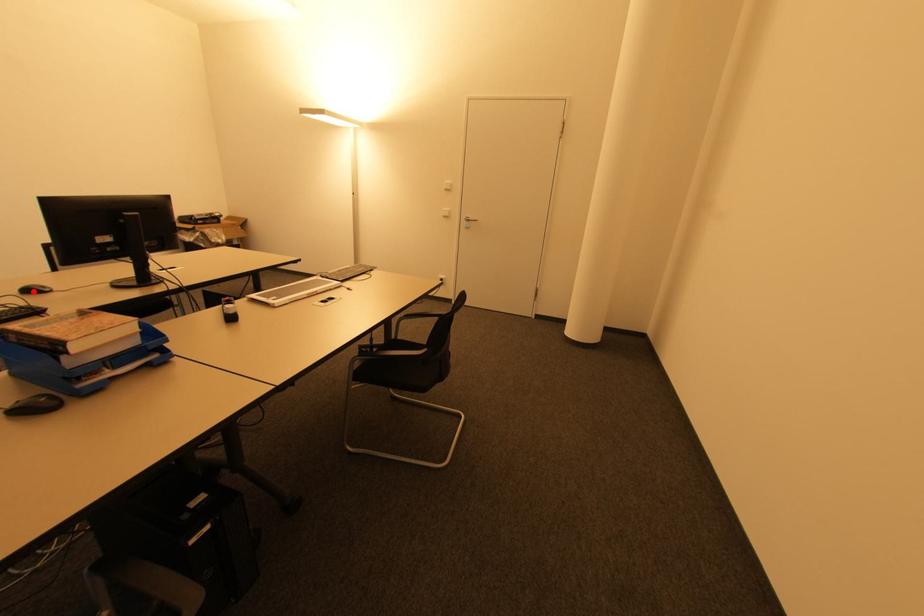
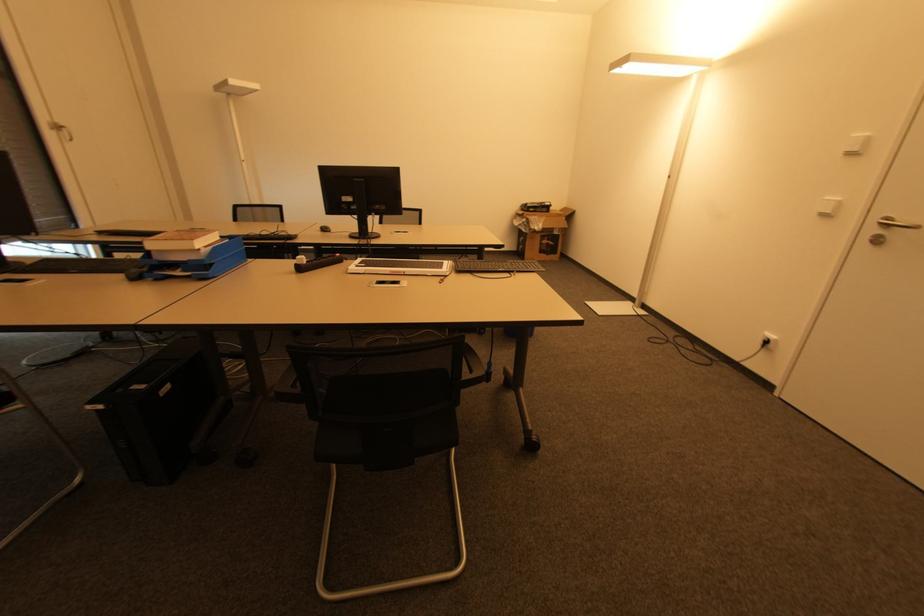
Find the pixel in the second image that matches the highlighted location in the first image.

(325, 230)